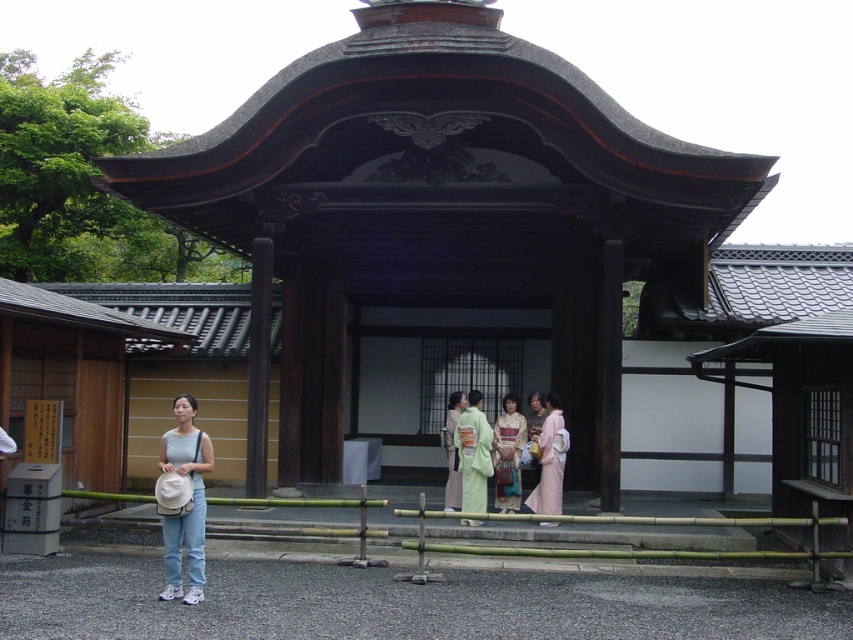
You are a photographer setting up for a traditional Japanese photo shoot inside the temple. You have two kimonos, the light green silk kimono at center and the light beige kimono at center, placed in the scene. Which kimono should you choose to focus on if you want the one that is more prominent in the foreground?

The light green silk kimono at center is closer to the viewer than the light beige kimono at center, so it would be more prominent in the foreground and should be chosen for focus.

You are standing at the entrance of the temple and want to take a photo of the point at coordinates (x=540, y=433). If your camera has a maximum focus range of 12 meters, will you be able to capture the point clearly?

The point at coordinates (x=540, y=433) is 12.33 meters away from the viewer. Since the camera can only focus up to 12 meters, it will not be able to capture the point clearly.

You are a photographer standing at the camera position. You want to capture a closeup shot of the pink silk kimono at center. Considering your current distance, do you think you can move closer to get a better closeup without leaving the paved area in front of the building?

The pink silk kimono at center is 11.78 meters away from the camera. Since you are already on the paved area in front of the building, you can move closer within the paved area to reduce the distance and get a better closeup shot.